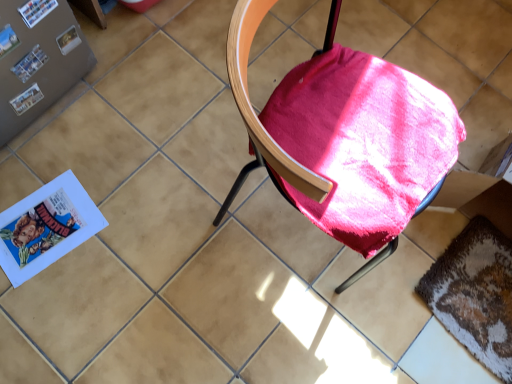
You are a GUI agent. You are given a task and a screenshot of the screen. Output one action in this format:
    pyautogui.click(x=<x>, y=<y>)
    Task: Click on the free point to the left of velvet-like pink cushion at center
    Image resolution: width=512 pixels, height=384 pixels.
    Given the screenshot: What is the action you would take?
    pyautogui.click(x=163, y=170)